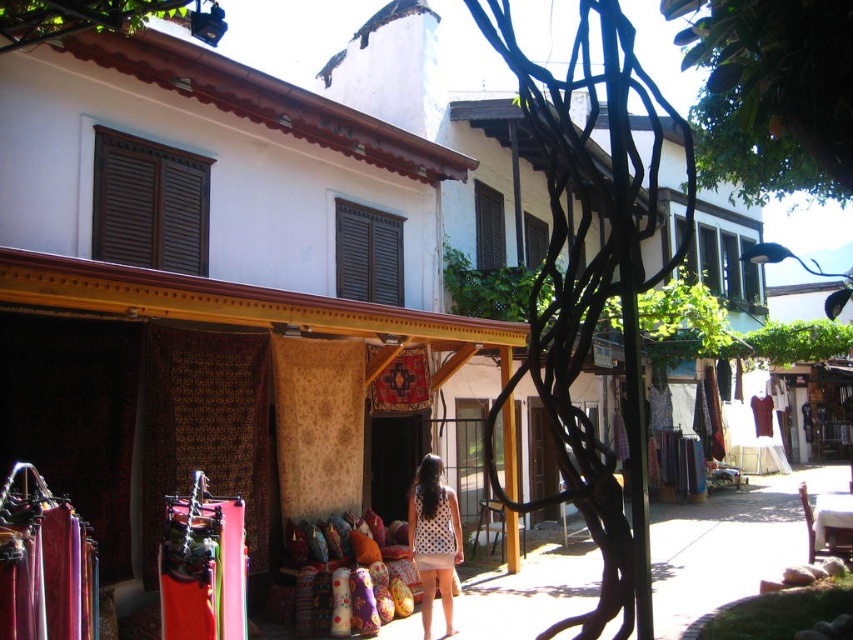
Question: Estimate the real-world distances between objects in this image. Which object is farther from the green leafy tree at upper right?

Choices:
 (A) white dotted dress at center
 (B) green leafy tree at upper center

Answer: (A)

Question: Which point is closer to the camera?

Choices:
 (A) (9, 35)
 (B) (434, 593)
 (C) (782, 68)

Answer: (C)

Question: From the image, what is the correct spatial relationship of green leafy tree at upper right in relation to white dotted dress at center?

Choices:
 (A) right
 (B) left

Answer: (A)

Question: Among these points, which one is farthest from the camera?

Choices:
 (A) (30, 13)
 (B) (425, 598)
 (C) (811, 108)

Answer: (B)

Question: Considering the relative positions of white dotted dress at center and green leafy tree at upper center in the image provided, where is white dotted dress at center located with respect to green leafy tree at upper center?

Choices:
 (A) above
 (B) below

Answer: (B)

Question: Can you confirm if white dotted dress at center is thinner than green leafy tree at upper center?

Choices:
 (A) no
 (B) yes

Answer: (B)